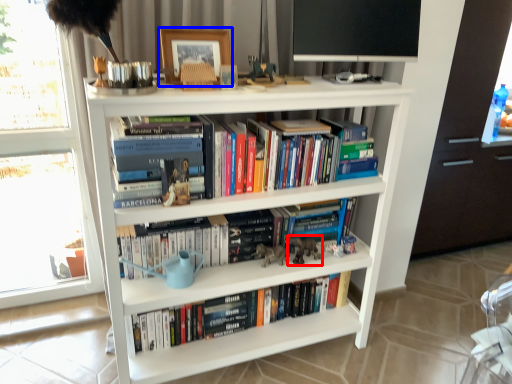
Question: Which point is closer to the camera, animal (highlighted by a red box) or picture frame (highlighted by a blue box)?

Choices:
 (A) animal
 (B) picture frame

Answer: (B)